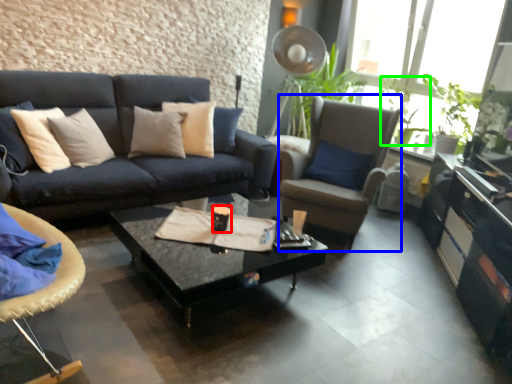
Question: Which is farther away from coffee cup (highlighted by a red box)? chair (highlighted by a blue box) or houseplant (highlighted by a green box)?

Choices:
 (A) chair
 (B) houseplant

Answer: (B)